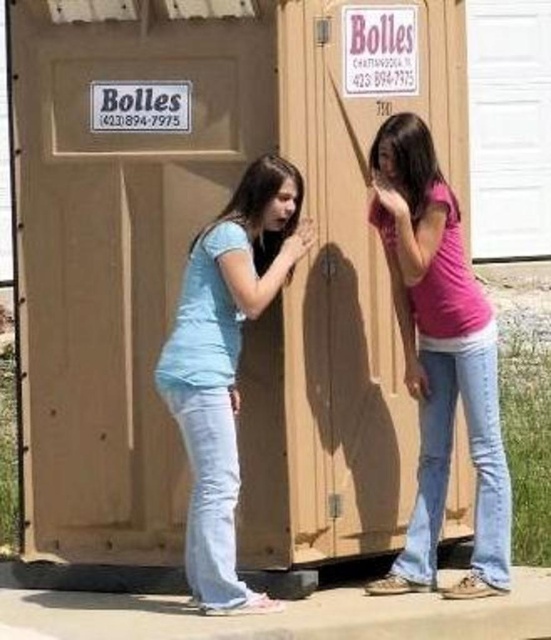
You are standing in front of the portable toilet and see a point marked at coordinates (x=440, y=358). Which object from the scene is located at that point?

The point at coordinates (x=440, y=358) indicates the pink matte shirt at center.

You are a photographer trying to capture both the pink matte shirt at center and the matte blue shirt at center in a single frame. Based on their heights, which shirt should you focus on to ensure both are fully visible in the photo?

The pink matte shirt at center is taller than the matte blue shirt at center, so focusing on the pink matte shirt at center would ensure both are fully visible in the photo.